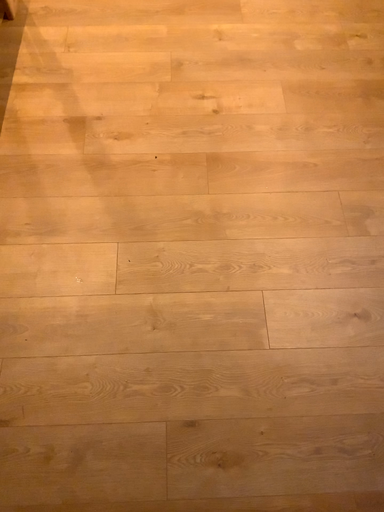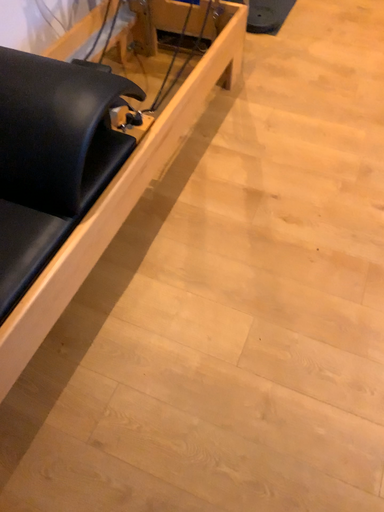
Question: How did the camera likely rotate when shooting the video?

Choices:
 (A) rotated downward
 (B) rotated upward

Answer: (B)